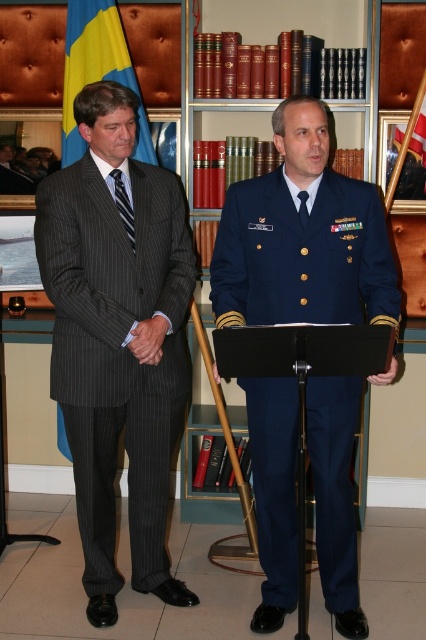
Can you confirm if yellow fabric flag at upper left is positioned to the left of striped fabric tie at left?

Correct, you'll find yellow fabric flag at upper left to the left of striped fabric tie at left.

Measure the distance from yellow fabric flag at upper left to striped fabric tie at left.

31.81 inches

Measure the distance between point (92, 28) and camera.

3.04 meters

The width and height of the screenshot is (426, 640). Identify the location of yellow fabric flag at upper left. (91, 61).

Can you confirm if matte black suit at left is smaller than striped fabric tie at left?

No, matte black suit at left is not smaller than striped fabric tie at left.

Can you confirm if matte black suit at left is shorter than striped fabric tie at left?

Indeed, matte black suit at left has a lesser height compared to striped fabric tie at left.

At what (x,y) coordinates should I click in order to perform the action: click on matte black suit at left. Please return your answer as a coordinate pair (x, y). The height and width of the screenshot is (640, 426). Looking at the image, I should click on (13, 176).

Who is more forward, (100,8) or (304,202)?

Point (304,202) is in front.

The height and width of the screenshot is (640, 426). What do you see at coordinates (91, 61) in the screenshot?
I see `yellow fabric flag at upper left` at bounding box center [91, 61].

Find the location of a particular element. This screenshot has height=640, width=426. yellow fabric flag at upper left is located at coordinates (91, 61).